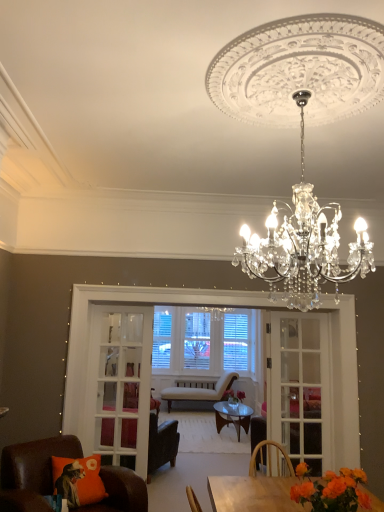
Question: Based on their sizes in the image, would you say brown leather chair at lower left, placed as the first chair when sorted from front to back, is bigger or smaller than clear crystal chandelier at upper center?

Choices:
 (A) small
 (B) big

Answer: (A)

Question: From the image's perspective, is brown leather chair at lower left, arranged as the 3th chair when viewed from the back, located above or below clear crystal chandelier at upper center?

Choices:
 (A) above
 (B) below

Answer: (B)

Question: Estimate the real-world distances between objects in this image. Which object is farther from the clear crystal chandelier at upper center?

Choices:
 (A) white glass screen door at center, positioned as the first screen door in left-to-right order
 (B) leather armchair at center, the 2th chair in the back-to-front sequence
 (C) orange fabric pillow at lower left
 (D) brown leather chair at lower left, placed as the first chair when sorted from front to back
 (E) pink matte vase at center, acting as the 2th flower starting from the front

Answer: (E)

Question: Which is farther from the orange fabric pillow at lower left?

Choices:
 (A) brown leather chair at lower left, placed as the first chair when sorted from front to back
 (B) white glass screen door at center, which is the second screen door in right-to-left order
 (C) orange matte flower at lower right, acting as the first flower starting from the top
 (D) pink matte vase at center, arranged as the 2th flower when viewed from the top
 (E) clear crystal chandelier at upper center

Answer: (D)